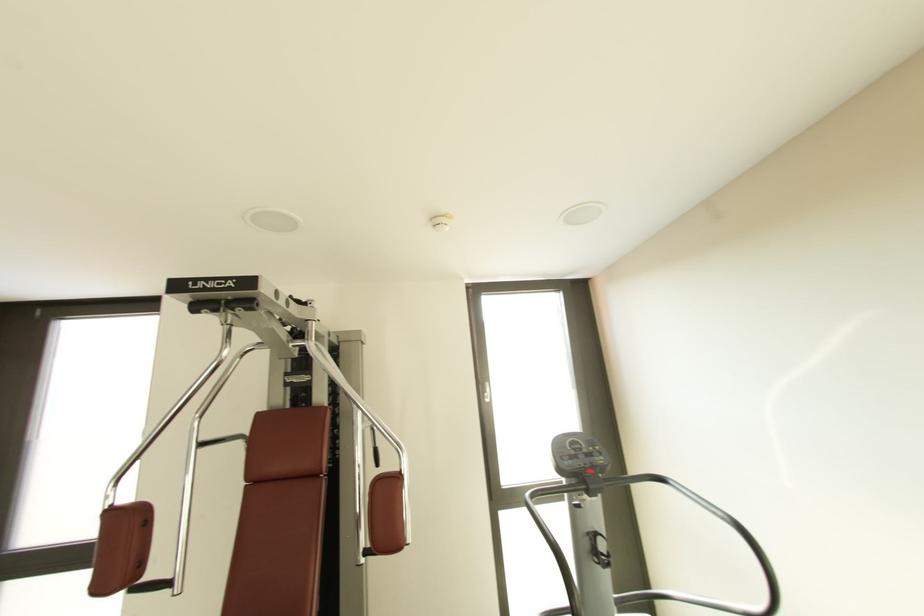
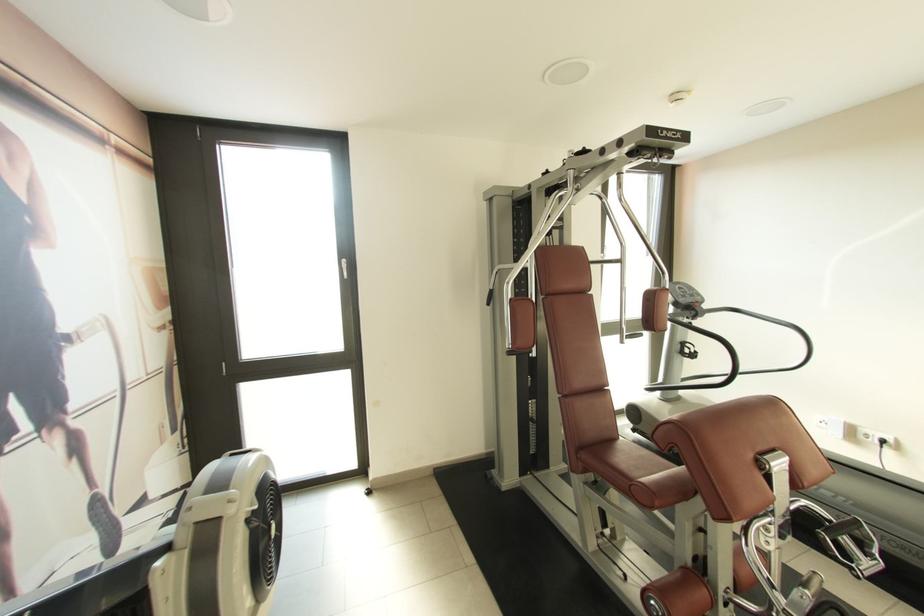
Question: What movement of the cameraman would produce the second image?

Choices:
 (A) Left
 (B) Right
 (C) Forward
 (D) Backward

Answer: (A)